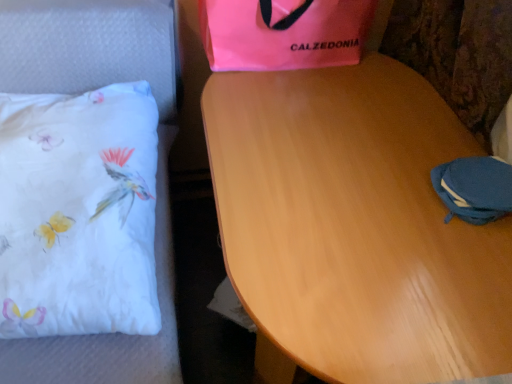
Identify the location of free space in front of blue fabric pouch at lower right. (468, 261).